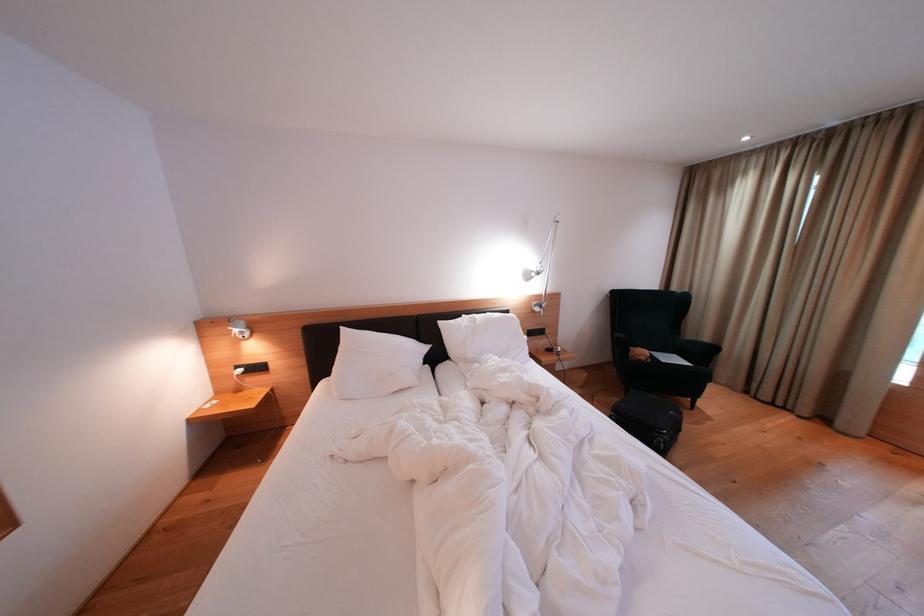
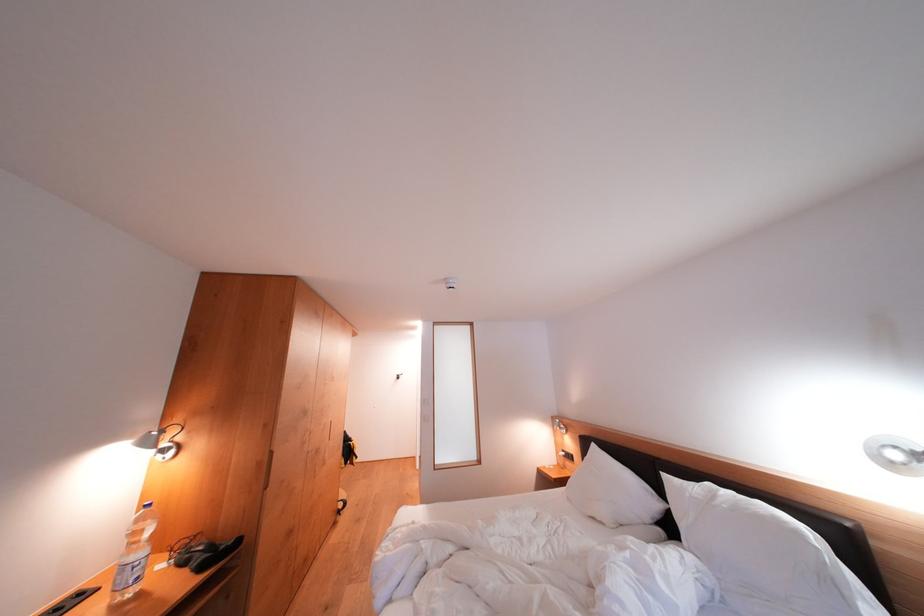
Where in the second image is the point corresponding to point 432,353 from the first image?

(664, 509)